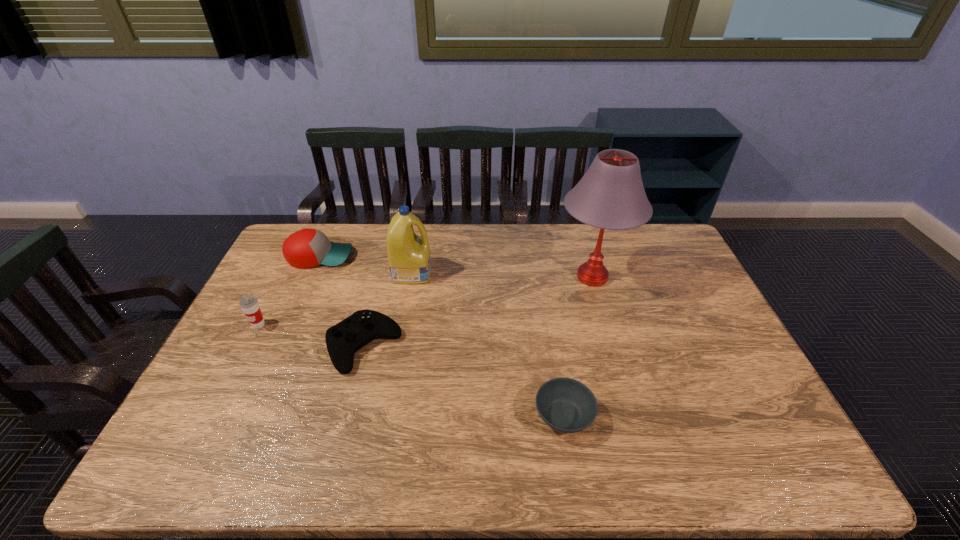
Identify the location of free spot that satisfies the following two spatial constraints: 1. at the brim of the fifth tallest object; 2. on the left side of the third shortest object. (280, 346).

Locate an element on the screen. The width and height of the screenshot is (960, 540). vacant space that satisfies the following two spatial constraints: 1. on the label of the second tallest object; 2. on the left side of the nearest object is located at coordinates (386, 416).

The width and height of the screenshot is (960, 540). In order to click on vacant position in the image that satisfies the following two spatial constraints: 1. on the label of the detergent; 2. on the right side of the nearest object in this screenshot , I will do `click(386, 416)`.

This screenshot has width=960, height=540. What are the coordinates of `free space that satisfies the following two spatial constraints: 1. on the side of the second shortest object with the logo; 2. on the right side of the cup` in the screenshot? It's located at point(248,346).

Find the location of a particular element. This screenshot has height=540, width=960. free region that satisfies the following two spatial constraints: 1. on the front-facing side of the tallest object; 2. on the side of the cup with the logo is located at coordinates (607, 325).